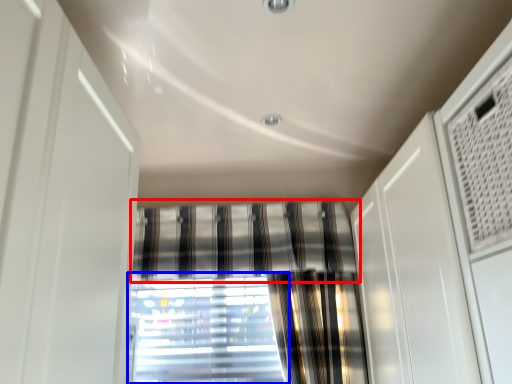
Question: Among these objects, which one is farthest to the camera, curtain (highlighted by a red box) or window (highlighted by a blue box)?

Choices:
 (A) curtain
 (B) window

Answer: (B)